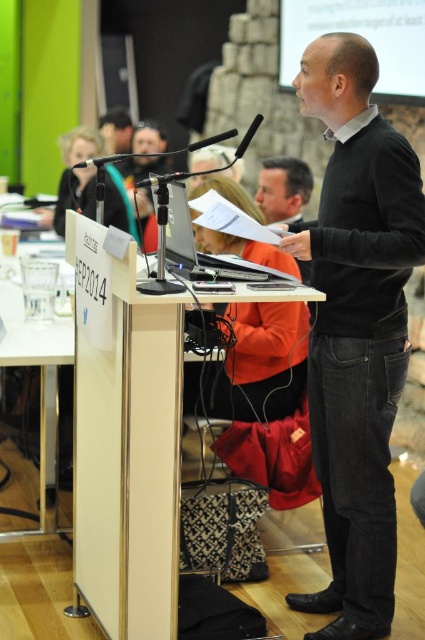
Who is positioned more to the right, black matte microphone at left or black plastic microphone at center?

Positioned to the right is black plastic microphone at center.

Is the position of black matte microphone at left more distant than that of black plastic microphone at center?

No, it is not.

Does point (101, 160) come farther from viewer compared to point (241, 148)?

Yes, it is.

Locate an element on the screen. The width and height of the screenshot is (425, 640). black matte microphone at left is located at coordinates (104, 161).

In the scene shown: Can you confirm if black velvet sweater at center is thinner than black matte microphone at left?

No, black velvet sweater at center is not thinner than black matte microphone at left.

Which is behind, point (311, 396) or point (102, 166)?

Positioned behind is point (311, 396).

The height and width of the screenshot is (640, 425). I want to click on black velvet sweater at center, so click(357, 328).

Is satin black laptop at center positioned in front of black plastic microphone at center?

No, satin black laptop at center is further to the viewer.

Is point (212, 204) farther from camera compared to point (261, 116)?

Yes, point (212, 204) is farther from viewer.

Identify the location of satin black laptop at center. Image resolution: width=425 pixels, height=640 pixels. (161, 225).